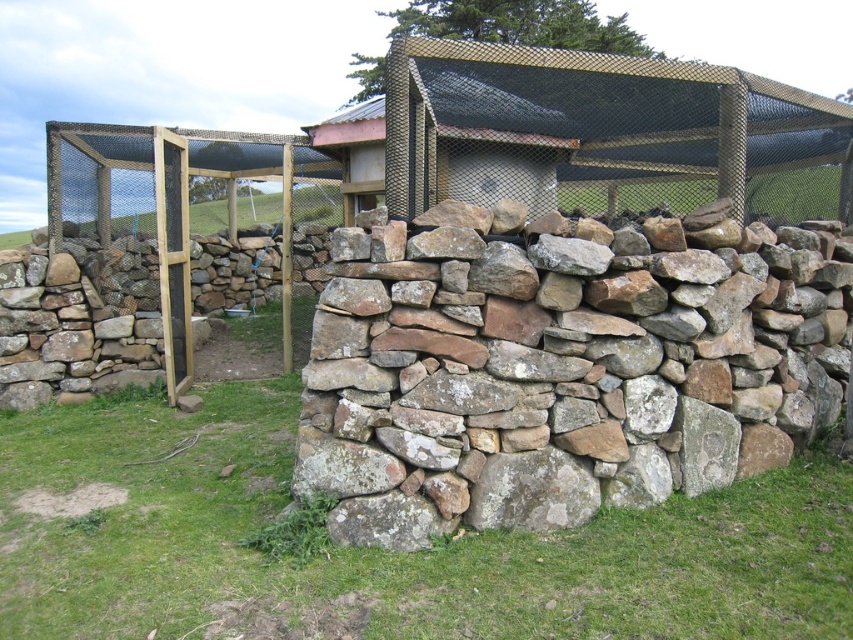
You are a farmer who wants to place a new water trough between the natural stone wall at center and the wooden mesh cage at center. The trough requires a minimum of 4 meters of space to be placed safely. Can you fit it there?

The distance between the natural stone wall at center and the wooden mesh cage at center is 3.85 meters, which is less than the required 4 meters. Therefore, the trough cannot be placed safely in that location.

You are standing in the rural area and see the natural stone wall at center and the green grass at lower center. Which object takes up more space in the scene?

The natural stone wall at center is bigger than the green grass at lower center, so it takes up more space in the scene.

In the scene shown: You are standing at the point closest to the stone wall in the image. There are two points marked in the scene, point A at coordinates point A is point (763, 586) and point B at coordinates point B is point (630, 154). Which point is closer to you?

Point A at coordinates point A is point (763, 586) is closer to you because it is in front of point B at coordinates point B is point (630, 154).